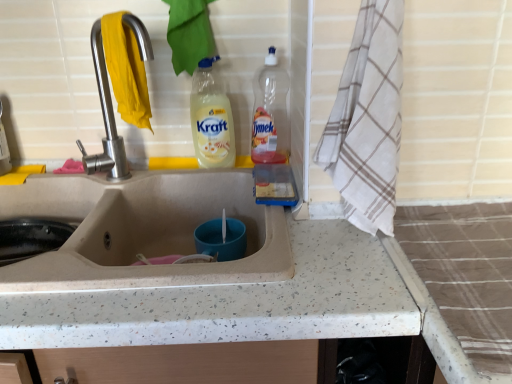
I want to click on speckled stone countertop at center, so click(x=232, y=303).

Describe the element at coordinates (105, 119) in the screenshot. I see `satin nickel faucet at upper left` at that location.

Where is `translucent plastic bottle at upper right, placed as the first bottle when sorted from right to left`? The width and height of the screenshot is (512, 384). translucent plastic bottle at upper right, placed as the first bottle when sorted from right to left is located at coordinates click(270, 113).

You are a GUI agent. You are given a task and a screenshot of the screen. Output one action in this format:
    pyautogui.click(x=<x>, y=<y>)
    Task: Click on the yellow translucent bottle at upper center, acting as the 1th bottle starting from the left
    
    Given the screenshot: What is the action you would take?
    pyautogui.click(x=211, y=118)

Is beige speckled sink at center positioned far away from yellow translucent bottle at upper center, the second bottle in the right-to-left sequence?

No, beige speckled sink at center is not far away from yellow translucent bottle at upper center, the second bottle in the right-to-left sequence.

From the image's perspective, does beige speckled sink at center appear lower than yellow translucent bottle at upper center, the second bottle in the right-to-left sequence?

Yes, from the image's perspective, beige speckled sink at center is below yellow translucent bottle at upper center, the second bottle in the right-to-left sequence.

What's the angular difference between beige speckled sink at center and yellow translucent bottle at upper center, the second bottle in the right-to-left sequence,'s facing directions?

The angle between the facing direction of beige speckled sink at center and the facing direction of yellow translucent bottle at upper center, the second bottle in the right-to-left sequence, is 0.000161 degrees.

Which object is positioned more to the right, beige speckled sink at center or yellow translucent bottle at upper center, the second bottle in the right-to-left sequence?

yellow translucent bottle at upper center, the second bottle in the right-to-left sequence, is more to the right.

Who is smaller, yellow translucent bottle at upper center, the second bottle in the right-to-left sequence, or white checkered towel at right?

yellow translucent bottle at upper center, the second bottle in the right-to-left sequence, is smaller.

Is yellow translucent bottle at upper center, the second bottle in the right-to-left sequence, oriented towards white checkered towel at right?

No, yellow translucent bottle at upper center, the second bottle in the right-to-left sequence, is not oriented towards white checkered towel at right.

From the image's perspective, is yellow translucent bottle at upper center, the second bottle in the right-to-left sequence, under white checkered towel at right?

No, from the image's perspective, yellow translucent bottle at upper center, the second bottle in the right-to-left sequence, is not below white checkered towel at right.

The image size is (512, 384). I want to click on bath towel on the right of yellow translucent bottle at upper center, the second bottle in the right-to-left sequence, so click(368, 119).

Which object is wider, beige speckled sink at center or speckled stone countertop at center?

speckled stone countertop at center.

Is speckled stone countertop at center at the back of beige speckled sink at center?

Yes, speckled stone countertop at center is at the back of beige speckled sink at center.

Between beige speckled sink at center and speckled stone countertop at center, which one appears on the left side from the viewer's perspective?

speckled stone countertop at center is more to the left.

In terms of height, does white checkered towel at right look taller or shorter compared to beige speckled sink at center?

Clearly, white checkered towel at right is taller compared to beige speckled sink at center.

The width and height of the screenshot is (512, 384). In order to click on bath towel that appears on the right of beige speckled sink at center in this screenshot , I will do `click(368, 119)`.

Is white checkered towel at right oriented towards beige speckled sink at center?

No, white checkered towel at right is not aimed at beige speckled sink at center.

Which object is wider, white checkered towel at right or beige speckled sink at center?

beige speckled sink at center is wider.

Is beige speckled sink at center in front of or behind white checkered towel at right in the image?

In the image, beige speckled sink at center appears behind white checkered towel at right.

Looking at the image, does beige speckled sink at center seem bigger or smaller compared to white checkered towel at right?

beige speckled sink at center is bigger than white checkered towel at right.

Between point (178, 194) and point (372, 126), which one is positioned behind?

The point (178, 194) is farther from the camera.

Is beige speckled sink at center in contact with white checkered towel at right?

No, beige speckled sink at center is not beside white checkered towel at right.

Does satin nickel faucet at upper left turn towards translucent plastic bottle at upper right, placed as the first bottle when sorted from right to left?

No, satin nickel faucet at upper left is not facing towards translucent plastic bottle at upper right, placed as the first bottle when sorted from right to left.

From a real-world perspective, is satin nickel faucet at upper left under translucent plastic bottle at upper right, which ranks as the 2th bottle in left-to-right order?

No, from a real-world perspective, satin nickel faucet at upper left is not under translucent plastic bottle at upper right, which ranks as the 2th bottle in left-to-right order.

Based on their sizes in the image, would you say satin nickel faucet at upper left is bigger or smaller than translucent plastic bottle at upper right, which ranks as the 2th bottle in left-to-right order?

Clearly, satin nickel faucet at upper left is smaller in size than translucent plastic bottle at upper right, which ranks as the 2th bottle in left-to-right order.

Which point is more distant from viewer, (139, 27) or (281, 74)?

The point (281, 74) is more distant.

Which object is more forward, translucent plastic bottle at upper right, placed as the first bottle when sorted from right to left, or speckled stone countertop at center?

speckled stone countertop at center is in front.

Find the location of a particular element. bottle that is the 2nd object located above the speckled stone countertop at center (from the image's perspective) is located at coordinates (270, 113).

Is translucent plastic bottle at upper right, which ranks as the 2th bottle in left-to-right order, far away from speckled stone countertop at center?

No.

Considering the sizes of objects translucent plastic bottle at upper right, which ranks as the 2th bottle in left-to-right order, and speckled stone countertop at center in the image provided, who is thinner, translucent plastic bottle at upper right, which ranks as the 2th bottle in left-to-right order, or speckled stone countertop at center?

Thinner between the two is translucent plastic bottle at upper right, which ranks as the 2th bottle in left-to-right order.

Where is `bottle that is the 1st one above the beige speckled sink at center (from a real-world perspective)`? Image resolution: width=512 pixels, height=384 pixels. bottle that is the 1st one above the beige speckled sink at center (from a real-world perspective) is located at coordinates (211, 118).

I want to click on bath towel below the yellow translucent bottle at upper center, the second bottle in the right-to-left sequence (from the image's perspective), so click(368, 119).

Looking at the image, which one is located closer to satin nickel faucet at upper left, beige speckled sink at center or speckled stone countertop at center?

Among the two, beige speckled sink at center is located nearer to satin nickel faucet at upper left.

From the image, which object appears to be farther from yellow translucent bottle at upper center, acting as the 1th bottle starting from the left, speckled stone countertop at center or beige speckled sink at center?

speckled stone countertop at center is further to yellow translucent bottle at upper center, acting as the 1th bottle starting from the left.

When comparing their distances from yellow translucent bottle at upper center, acting as the 1th bottle starting from the left, does satin nickel faucet at upper left or beige speckled sink at center seem closer?

Based on the image, satin nickel faucet at upper left appears to be nearer to yellow translucent bottle at upper center, acting as the 1th bottle starting from the left.

From the image, which object appears to be nearer to satin nickel faucet at upper left, speckled stone countertop at center or translucent plastic bottle at upper right, which ranks as the 2th bottle in left-to-right order?

translucent plastic bottle at upper right, which ranks as the 2th bottle in left-to-right order, is closer to satin nickel faucet at upper left.

When comparing their distances from satin nickel faucet at upper left, does beige speckled sink at center or translucent plastic bottle at upper right, placed as the first bottle when sorted from right to left, seem closer?

beige speckled sink at center.

From the image, which object appears to be farther from translucent plastic bottle at upper right, which ranks as the 2th bottle in left-to-right order, satin nickel faucet at upper left or yellow translucent bottle at upper center, the second bottle in the right-to-left sequence?

satin nickel faucet at upper left is positioned further to the anchor translucent plastic bottle at upper right, which ranks as the 2th bottle in left-to-right order.

From the image, which object appears to be nearer to beige speckled sink at center, white checkered towel at right or satin nickel faucet at upper left?

The object closer to beige speckled sink at center is satin nickel faucet at upper left.

Looking at the image, which one is located further to speckled stone countertop at center, yellow translucent bottle at upper center, the second bottle in the right-to-left sequence, or satin nickel faucet at upper left?

The object further to speckled stone countertop at center is satin nickel faucet at upper left.

The height and width of the screenshot is (384, 512). Find the location of `bath towel between yellow translucent bottle at upper center, the second bottle in the right-to-left sequence, and speckled stone countertop at center, in the vertical direction`. bath towel between yellow translucent bottle at upper center, the second bottle in the right-to-left sequence, and speckled stone countertop at center, in the vertical direction is located at coordinates click(368, 119).

Find the location of a particular element. The height and width of the screenshot is (384, 512). sink between satin nickel faucet at upper left and speckled stone countertop at center in the up-down direction is located at coordinates (143, 230).

This screenshot has width=512, height=384. I want to click on bottle that lies between translucent plastic bottle at upper right, placed as the first bottle when sorted from right to left, and speckled stone countertop at center from top to bottom, so click(211, 118).

Where is `tap between beige speckled sink at center and white checkered towel at right from left to right`? tap between beige speckled sink at center and white checkered towel at right from left to right is located at coordinates (105, 119).